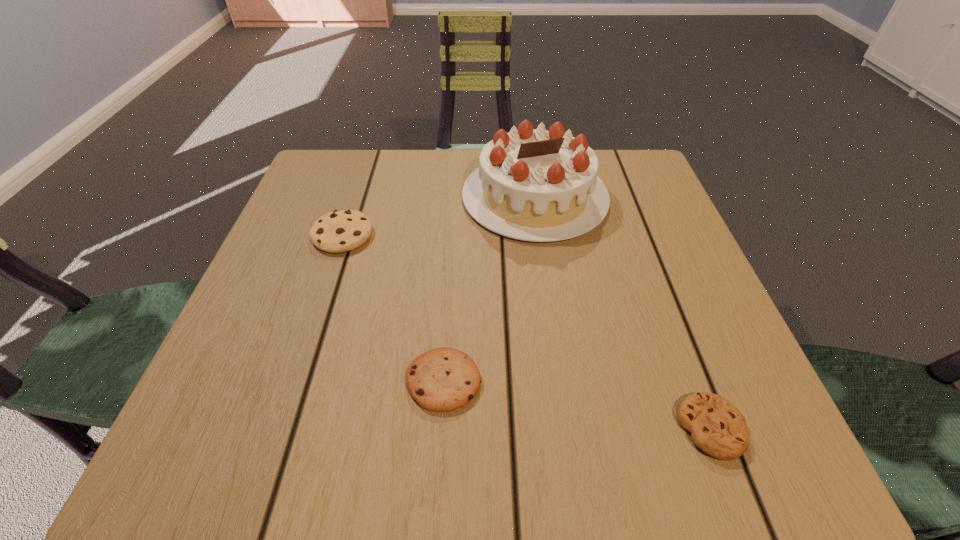
At what (x,y) coordinates should I click in order to perform the action: click on vacant space that is in between the second tallest cookie and the shortest cookie. Please return your answer as a coordinate pair (x, y). The image size is (960, 540). Looking at the image, I should click on (577, 404).

At what (x,y) coordinates should I click in order to perform the action: click on vacant area that lies between the third shortest object and the tallest object. Please return your answer as a coordinate pair (x, y). Looking at the image, I should click on (439, 216).

The width and height of the screenshot is (960, 540). I want to click on vacant space that is in between the rightmost cookie and the second cookie from left to right, so click(x=577, y=404).

Select which object appears as the second closest to the shortest object. Please provide its 2D coordinates. Your answer should be formatted as a tuple, i.e. [(x, y)], where the tuple contains the x and y coordinates of a point satisfying the conditions above.

[(536, 185)]

Choose which object is the second nearest neighbor to the leftmost cookie. Please provide its 2D coordinates. Your answer should be formatted as a tuple, i.e. [(x, y)], where the tuple contains the x and y coordinates of a point satisfying the conditions above.

[(443, 379)]

Locate which cookie ranks in proximity to the shortest cookie. Please provide its 2D coordinates. Your answer should be formatted as a tuple, i.e. [(x, y)], where the tuple contains the x and y coordinates of a point satisfying the conditions above.

[(443, 379)]

Point out which cookie is positioned as the third nearest to the birthday cake. Please provide its 2D coordinates. Your answer should be formatted as a tuple, i.e. [(x, y)], where the tuple contains the x and y coordinates of a point satisfying the conditions above.

[(717, 427)]

Find the location of a particular element. This screenshot has height=540, width=960. free space that satisfies the following two spatial constraints: 1. on the back side of the third tallest object; 2. on the right side of the tallest object is located at coordinates (456, 197).

Image resolution: width=960 pixels, height=540 pixels. What are the coordinates of `free space in the image that satisfies the following two spatial constraints: 1. on the front side of the second shortest object; 2. on the left side of the shortest cookie` in the screenshot? It's located at (441, 428).

Locate an element on the screen. This screenshot has height=540, width=960. vacant region that satisfies the following two spatial constraints: 1. on the front side of the leftmost cookie; 2. on the left side of the second tallest cookie is located at coordinates (295, 381).